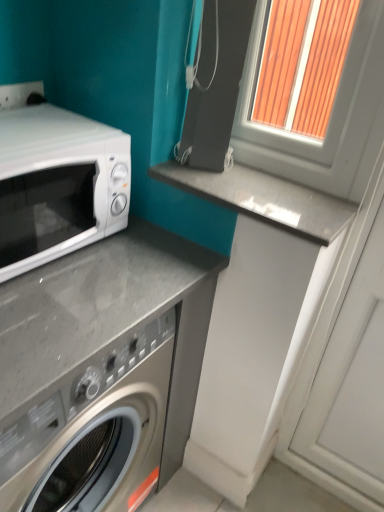
Question: In terms of size, does white glossy microwave at left appear bigger or smaller than white plastic window frame at upper right?

Choices:
 (A) small
 (B) big

Answer: (A)

Question: Is point (87, 184) positioned closer to the camera than point (344, 106)?

Choices:
 (A) closer
 (B) farther

Answer: (A)

Question: Estimate the real-world distances between objects in this image. Which object is closer to the gray polished stone counter top at center?

Choices:
 (A) white plastic window frame at upper right
 (B) white glossy microwave at left

Answer: (A)

Question: Considering the real-world distances, which object is farthest from the white plastic window frame at upper right?

Choices:
 (A) gray polished stone counter top at center
 (B) white glossy microwave at left

Answer: (B)